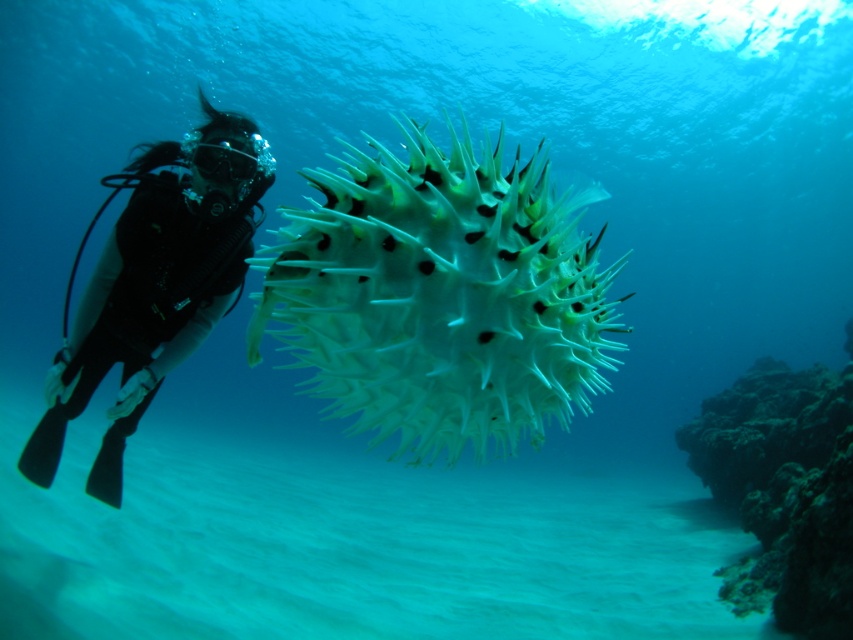
Question: Which object is positioned closest to the dark brown rocky coral reef at lower right?

Choices:
 (A) translucent spiky fish at center
 (B) black matte scuba diver at left

Answer: (B)

Question: Is black matte scuba diver at left thinner than dark brown rocky coral reef at lower right?

Choices:
 (A) yes
 (B) no

Answer: (B)

Question: Which point appears closest to the camera in this image?

Choices:
 (A) (704, 458)
 (B) (119, 492)
 (C) (587, 240)

Answer: (C)

Question: Which object is closer to the camera taking this photo?

Choices:
 (A) translucent spiky fish at center
 (B) dark brown rocky coral reef at lower right
 (C) black matte scuba diver at left

Answer: (A)

Question: Is black matte scuba diver at left above dark brown rocky coral reef at lower right?

Choices:
 (A) no
 (B) yes

Answer: (B)

Question: Considering the relative positions of translucent spiky fish at center and black matte scuba diver at left in the image provided, where is translucent spiky fish at center located with respect to black matte scuba diver at left?

Choices:
 (A) left
 (B) right

Answer: (B)